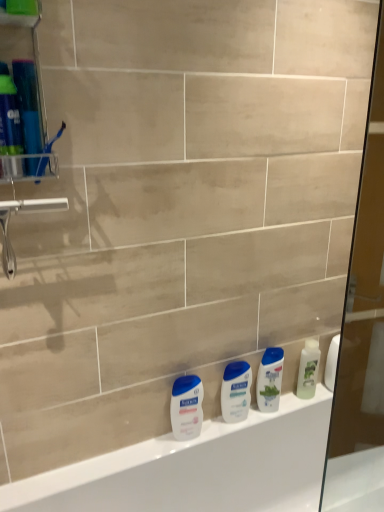
Locate an element on the screen. clear plastic toothbrush holder at left is located at coordinates (23, 101).

What do you see at coordinates (270, 379) in the screenshot? I see `white glossy shampoo at center, acting as the 1th cleaning product starting from the left` at bounding box center [270, 379].

How much space does white glossy lotion at lower center, which is counted as the 1th toiletry, starting from the left, occupy horizontally?

It is 2.18 inches.

The width and height of the screenshot is (384, 512). What do you see at coordinates (186, 407) in the screenshot? I see `white glossy lotion at lower center, which is counted as the 1th toiletry, starting from the left` at bounding box center [186, 407].

The image size is (384, 512). What are the coordinates of `white glossy bathtub at lower center` in the screenshot? It's located at (198, 468).

I want to click on white glossy lotion at center, acting as the first toiletry starting from the right, so click(x=236, y=391).

The width and height of the screenshot is (384, 512). Find the location of `green matte lotion at right, positioned as the 1th cleaning product in right-to-left order`. green matte lotion at right, positioned as the 1th cleaning product in right-to-left order is located at coordinates (308, 369).

From a real-world perspective, is white glossy shampoo at center, which is the second cleaning product in right-to-left order, below white glossy lotion at lower center, positioned as the 2th toiletry in right-to-left order?

No, from a real-world perspective, white glossy shampoo at center, which is the second cleaning product in right-to-left order, is not under white glossy lotion at lower center, positioned as the 2th toiletry in right-to-left order.

From the image's perspective, is white glossy shampoo at center, which is the second cleaning product in right-to-left order, above white glossy lotion at lower center, which is counted as the 1th toiletry, starting from the left?

Correct, white glossy shampoo at center, which is the second cleaning product in right-to-left order, appears higher than white glossy lotion at lower center, which is counted as the 1th toiletry, starting from the left, in the image.

Considering the points (269, 362) and (177, 421), which point is behind, point (269, 362) or point (177, 421)?

Point (269, 362)

Does white glossy shampoo at center, which is the second cleaning product in right-to-left order, have a lesser height compared to white glossy lotion at lower center, positioned as the 2th toiletry in right-to-left order?

In fact, white glossy shampoo at center, which is the second cleaning product in right-to-left order, may be taller than white glossy lotion at lower center, positioned as the 2th toiletry in right-to-left order.

From a real-world perspective, is white glossy lotion at lower center, positioned as the 2th toiletry in right-to-left order, on white glossy shampoo at center, which is the second cleaning product in right-to-left order?

Incorrect, from a real-world perspective, white glossy lotion at lower center, positioned as the 2th toiletry in right-to-left order, is lower than white glossy shampoo at center, which is the second cleaning product in right-to-left order.

Is white glossy lotion at lower center, which is counted as the 1th toiletry, starting from the left, directly adjacent to white glossy shampoo at center, acting as the 1th cleaning product starting from the left?

white glossy lotion at lower center, which is counted as the 1th toiletry, starting from the left, and white glossy shampoo at center, acting as the 1th cleaning product starting from the left, are not in contact.

From the image's perspective, is white glossy lotion at lower center, which is counted as the 1th toiletry, starting from the left, located beneath white glossy shampoo at center, acting as the 1th cleaning product starting from the left?

Yes, from the image's perspective, white glossy lotion at lower center, which is counted as the 1th toiletry, starting from the left, is below white glossy shampoo at center, acting as the 1th cleaning product starting from the left.

How many degrees apart are the facing directions of white glossy lotion at center, the 2th toiletry in the left-to-right sequence, and green matte lotion at right, positioned as the 1th cleaning product in right-to-left order?

They differ by 0.00122 degrees in their facing directions.

Between white glossy lotion at center, the 2th toiletry in the left-to-right sequence, and green matte lotion at right, the 2th cleaning product positioned from the left, which one has larger width?

white glossy lotion at center, the 2th toiletry in the left-to-right sequence, is wider.

Is green matte lotion at right, the 2th cleaning product positioned from the left, located within white glossy lotion at center, acting as the first toiletry starting from the right?

Actually, green matte lotion at right, the 2th cleaning product positioned from the left, is outside white glossy lotion at center, acting as the first toiletry starting from the right.

Considering the positions of points (243, 413) and (308, 367), is point (243, 413) closer to camera compared to point (308, 367)?

Yes, point (243, 413) is in front of point (308, 367).

Who is shorter, white glossy lotion at center, acting as the first toiletry starting from the right, or white glossy lotion at lower center, positioned as the 2th toiletry in right-to-left order?

white glossy lotion at center, acting as the first toiletry starting from the right, is shorter.

Does white glossy lotion at center, acting as the first toiletry starting from the right, contain white glossy lotion at lower center, which is counted as the 1th toiletry, starting from the left?

No.

From the image's perspective, is white glossy lotion at center, acting as the first toiletry starting from the right, located above or below white glossy lotion at lower center, which is counted as the 1th toiletry, starting from the left?

Based on their image positions, white glossy lotion at center, acting as the first toiletry starting from the right, is located above white glossy lotion at lower center, which is counted as the 1th toiletry, starting from the left.

Can you confirm if white glossy lotion at center, the 2th toiletry in the left-to-right sequence, is positioned to the left of clear plastic toothbrush holder at left?

No, white glossy lotion at center, the 2th toiletry in the left-to-right sequence, is not to the left of clear plastic toothbrush holder at left.

From the image's perspective, between white glossy lotion at center, the 2th toiletry in the left-to-right sequence, and clear plastic toothbrush holder at left, who is located below?

white glossy lotion at center, the 2th toiletry in the left-to-right sequence.

Does white glossy lotion at center, acting as the first toiletry starting from the right, come in front of clear plastic toothbrush holder at left?

No, the depth of white glossy lotion at center, acting as the first toiletry starting from the right, is greater than that of clear plastic toothbrush holder at left.

From the image's perspective, between white glossy bathtub at lower center and clear plastic toothbrush holder at left, which one is located above?

clear plastic toothbrush holder at left is shown above in the image.

From the picture: Can you confirm if white glossy bathtub at lower center is shorter than clear plastic toothbrush holder at left?

In fact, white glossy bathtub at lower center may be taller than clear plastic toothbrush holder at left.

Where is `bathtub on the right of clear plastic toothbrush holder at left`? The width and height of the screenshot is (384, 512). bathtub on the right of clear plastic toothbrush holder at left is located at coordinates (198, 468).

Based on the photo, is white glossy bathtub at lower center not within clear plastic toothbrush holder at left?

Yes.

Is there a large distance between white glossy lotion at lower center, positioned as the 2th toiletry in right-to-left order, and white glossy lotion at center, the 2th toiletry in the left-to-right sequence?

white glossy lotion at lower center, positioned as the 2th toiletry in right-to-left order, is actually quite close to white glossy lotion at center, the 2th toiletry in the left-to-right sequence.

Considering the relative sizes of white glossy lotion at lower center, positioned as the 2th toiletry in right-to-left order, and white glossy lotion at center, the 2th toiletry in the left-to-right sequence, in the image provided, is white glossy lotion at lower center, positioned as the 2th toiletry in right-to-left order, shorter than white glossy lotion at center, the 2th toiletry in the left-to-right sequence,?

Incorrect, the height of white glossy lotion at lower center, positioned as the 2th toiletry in right-to-left order, does not fall short of that of white glossy lotion at center, the 2th toiletry in the left-to-right sequence.

You are a GUI agent. You are given a task and a screenshot of the screen. Output one action in this format:
    pyautogui.click(x=<x>, y=<y>)
    Task: Click on the toiletry below the white glossy lotion at center, the 2th toiletry in the left-to-right sequence (from the image's perspective)
    This screenshot has width=384, height=512.
    Given the screenshot: What is the action you would take?
    pyautogui.click(x=186, y=407)

Is white glossy lotion at lower center, positioned as the 2th toiletry in right-to-left order, to the left or to the right of white glossy lotion at center, the 2th toiletry in the left-to-right sequence, in the image?

white glossy lotion at lower center, positioned as the 2th toiletry in right-to-left order, is positioned on white glossy lotion at center, the 2th toiletry in the left-to-right sequence,'s left side.

Locate an element on the screen. the 2nd cleaning product directly above the white glossy lotion at lower center, which is counted as the 1th toiletry, starting from the left (from a real-world perspective) is located at coordinates (270, 379).

Where is `the 1st cleaning product positioned above the white glossy lotion at lower center, positioned as the 2th toiletry in right-to-left order (from the image's perspective)`? This screenshot has width=384, height=512. the 1st cleaning product positioned above the white glossy lotion at lower center, positioned as the 2th toiletry in right-to-left order (from the image's perspective) is located at coordinates (270, 379).

Considering their positions, is white glossy lotion at center, the 2th toiletry in the left-to-right sequence, positioned closer to green matte lotion at right, positioned as the 1th cleaning product in right-to-left order, than white glossy bathtub at lower center?

white glossy lotion at center, the 2th toiletry in the left-to-right sequence, is closer to green matte lotion at right, positioned as the 1th cleaning product in right-to-left order.

Estimate the real-world distances between objects in this image. Which object is closer to white glossy lotion at center, acting as the first toiletry starting from the right, clear plastic toothbrush holder at left or white glossy bathtub at lower center?

Among the two, white glossy bathtub at lower center is located nearer to white glossy lotion at center, acting as the first toiletry starting from the right.

When comparing their distances from white glossy bathtub at lower center, does white glossy shampoo at center, acting as the 1th cleaning product starting from the left, or white glossy lotion at lower center, which is counted as the 1th toiletry, starting from the left, seem further?

white glossy shampoo at center, acting as the 1th cleaning product starting from the left, is positioned further to the anchor white glossy bathtub at lower center.

Looking at the image, which one is located further to green matte lotion at right, positioned as the 1th cleaning product in right-to-left order, clear plastic toothbrush holder at left or white glossy lotion at lower center, positioned as the 2th toiletry in right-to-left order?

A: Among the two, clear plastic toothbrush holder at left is located further to green matte lotion at right, positioned as the 1th cleaning product in right-to-left order.

Looking at the image, which one is located further to clear plastic toothbrush holder at left, white glossy shampoo at center, acting as the 1th cleaning product starting from the left, or white glossy lotion at lower center, positioned as the 2th toiletry in right-to-left order?

white glossy shampoo at center, acting as the 1th cleaning product starting from the left.

From the image, which object appears to be farther from green matte lotion at right, positioned as the 1th cleaning product in right-to-left order, white glossy lotion at lower center, positioned as the 2th toiletry in right-to-left order, or white glossy bathtub at lower center?

white glossy lotion at lower center, positioned as the 2th toiletry in right-to-left order, is positioned further to the anchor green matte lotion at right, positioned as the 1th cleaning product in right-to-left order.

Estimate the real-world distances between objects in this image. Which object is further from white glossy bathtub at lower center, white glossy lotion at lower center, which is counted as the 1th toiletry, starting from the left, or white glossy lotion at center, acting as the first toiletry starting from the right?

The object further to white glossy bathtub at lower center is white glossy lotion at lower center, which is counted as the 1th toiletry, starting from the left.

Looking at the image, which one is located closer to white glossy lotion at lower center, positioned as the 2th toiletry in right-to-left order, clear plastic toothbrush holder at left or green matte lotion at right, the 2th cleaning product positioned from the left?

The object closer to white glossy lotion at lower center, positioned as the 2th toiletry in right-to-left order, is green matte lotion at right, the 2th cleaning product positioned from the left.

This screenshot has width=384, height=512. What are the coordinates of `toiletry between white glossy lotion at lower center, positioned as the 2th toiletry in right-to-left order, and white glossy shampoo at center, which is the second cleaning product in right-to-left order, in the horizontal direction` in the screenshot? It's located at (236, 391).

Find the location of a particular element. Image resolution: width=384 pixels, height=512 pixels. cleaning product between white glossy lotion at lower center, which is counted as the 1th toiletry, starting from the left, and green matte lotion at right, the 2th cleaning product positioned from the left is located at coordinates (270, 379).

You are a GUI agent. You are given a task and a screenshot of the screen. Output one action in this format:
    pyautogui.click(x=<x>, y=<y>)
    Task: Click on the cleaning product between white glossy lotion at center, the 2th toiletry in the left-to-right sequence, and green matte lotion at right, positioned as the 1th cleaning product in right-to-left order
    The image size is (384, 512).
    Given the screenshot: What is the action you would take?
    coord(270,379)

Image resolution: width=384 pixels, height=512 pixels. Find the location of `toiletry located between white glossy lotion at lower center, which is counted as the 1th toiletry, starting from the left, and green matte lotion at right, positioned as the 1th cleaning product in right-to-left order, in the left-right direction`. toiletry located between white glossy lotion at lower center, which is counted as the 1th toiletry, starting from the left, and green matte lotion at right, positioned as the 1th cleaning product in right-to-left order, in the left-right direction is located at coordinates (236, 391).